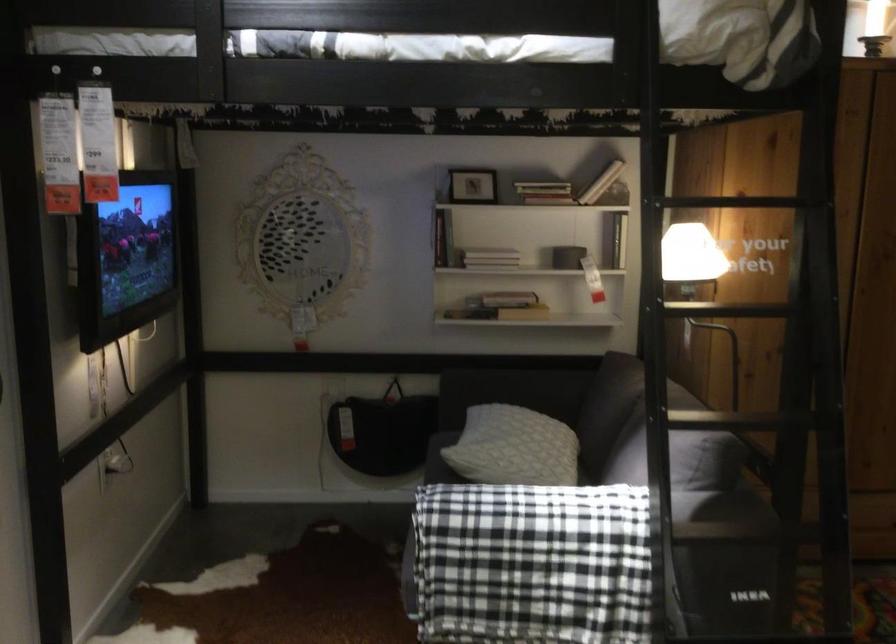
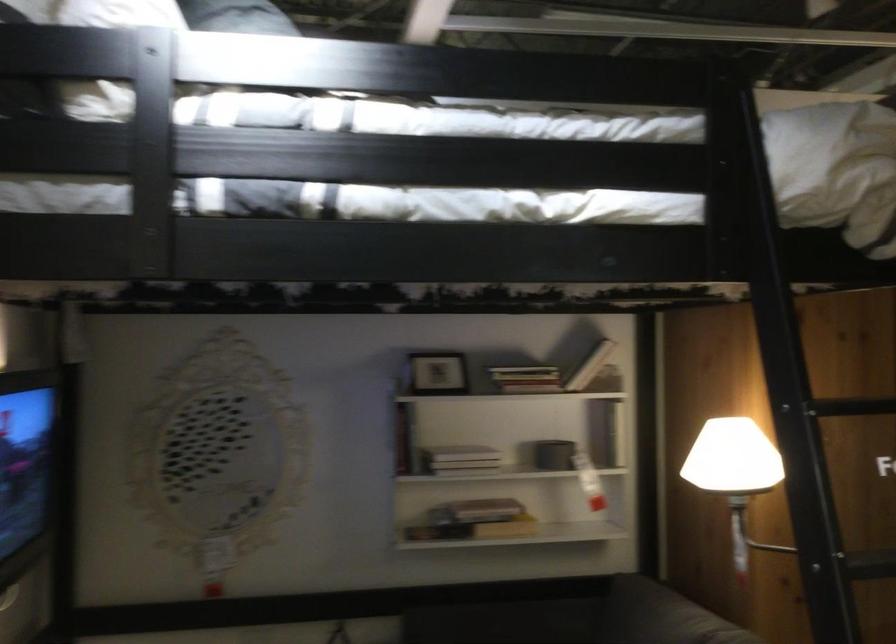
In the second image, find the point that corresponds to pixel 682 254 in the first image.

(736, 474)